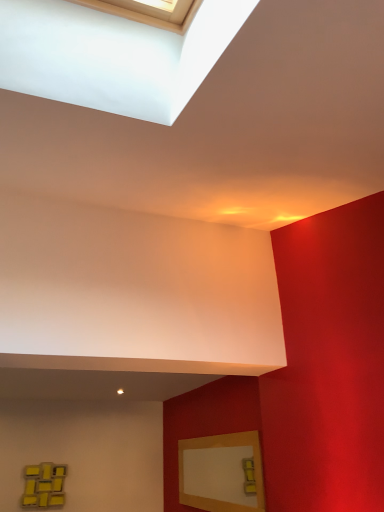
Question: Can you confirm if yellow matte picture frame at lower left, the 2th picture frame in the front-to-back sequence, is positioned to the right of matte wood picture frame at lower right, which appears as the second picture frame when viewed from the left?

Choices:
 (A) yes
 (B) no

Answer: (B)

Question: Is the position of yellow matte picture frame at lower left, the 2th picture frame in the front-to-back sequence, less distant than that of matte wood picture frame at lower right, which is the first picture frame from right to left?

Choices:
 (A) no
 (B) yes

Answer: (A)

Question: Is matte wood picture frame at lower right, the first picture frame viewed from the front, inside yellow matte picture frame at lower left, the 2th picture frame from the right?

Choices:
 (A) yes
 (B) no

Answer: (B)

Question: From a real-world perspective, is yellow matte picture frame at lower left, arranged as the 1th picture frame when viewed from the back, positioned under matte wood picture frame at lower right, the 2th picture frame from the back, based on gravity?

Choices:
 (A) yes
 (B) no

Answer: (A)

Question: Could you tell me if yellow matte picture frame at lower left, the first picture frame viewed from the left, is facing matte wood picture frame at lower right, the first picture frame viewed from the front?

Choices:
 (A) yes
 (B) no

Answer: (B)

Question: From the image's perspective, is yellow matte picture frame at lower left, the 2th picture frame in the front-to-back sequence, on matte wood picture frame at lower right, which is the first picture frame from right to left?

Choices:
 (A) no
 (B) yes

Answer: (A)

Question: Is matte wood picture frame at lower right, which appears as the second picture frame when viewed from the left, closer to the viewer compared to yellow matte picture frame at lower left, the first picture frame viewed from the left?

Choices:
 (A) yes
 (B) no

Answer: (A)

Question: Is matte wood picture frame at lower right, the first picture frame viewed from the front, with yellow matte picture frame at lower left, arranged as the 1th picture frame when viewed from the back?

Choices:
 (A) yes
 (B) no

Answer: (B)

Question: Considering the relative positions of matte wood picture frame at lower right, the 2th picture frame from the back, and yellow matte picture frame at lower left, the first picture frame viewed from the left, in the image provided, is matte wood picture frame at lower right, the 2th picture frame from the back, to the left of yellow matte picture frame at lower left, the first picture frame viewed from the left, from the viewer's perspective?

Choices:
 (A) yes
 (B) no

Answer: (B)

Question: Is matte wood picture frame at lower right, the first picture frame viewed from the front, positioned beyond the bounds of yellow matte picture frame at lower left, the 2th picture frame from the right?

Choices:
 (A) yes
 (B) no

Answer: (A)

Question: Considering the relative sizes of matte wood picture frame at lower right, the first picture frame viewed from the front, and yellow matte picture frame at lower left, arranged as the 1th picture frame when viewed from the back, in the image provided, is matte wood picture frame at lower right, the first picture frame viewed from the front, taller than yellow matte picture frame at lower left, arranged as the 1th picture frame when viewed from the back,?

Choices:
 (A) yes
 (B) no

Answer: (A)

Question: From a real-world perspective, does matte wood picture frame at lower right, the 2th picture frame from the back, stand above yellow matte picture frame at lower left, the 2th picture frame in the front-to-back sequence?

Choices:
 (A) yes
 (B) no

Answer: (A)

Question: In the image, is matte wood picture frame at lower right, which is the first picture frame from right to left, on the left side or the right side of yellow matte picture frame at lower left, the first picture frame viewed from the left?

Choices:
 (A) right
 (B) left

Answer: (A)